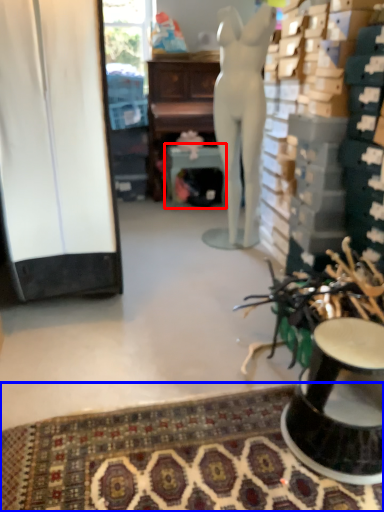
Question: Which object is closer to the camera taking this photo, round table (highlighted by a red box) or mat (highlighted by a blue box)?

Choices:
 (A) round table
 (B) mat

Answer: (B)